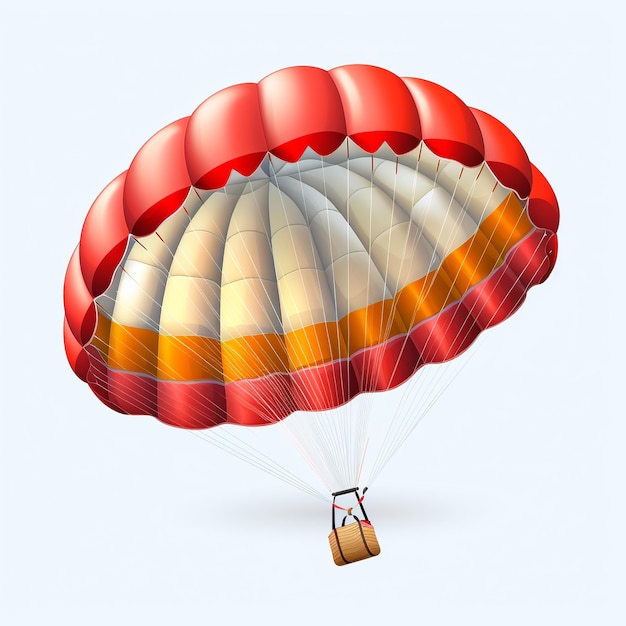
Locate an element on the screen. Image resolution: width=626 pixels, height=626 pixels. cable is located at coordinates (365, 397).